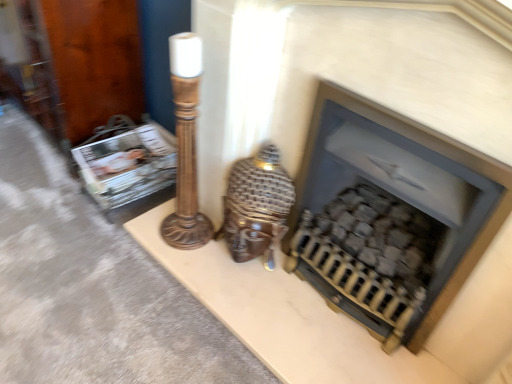
Locate an element on the screen. free space in front of brown wooden table lamp at center is located at coordinates (252, 293).